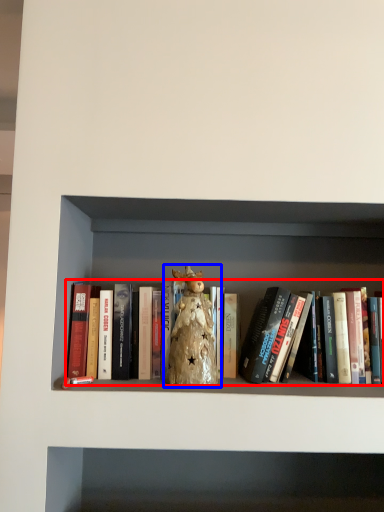
Question: Which object appears closest to the camera in this image, book (highlighted by a red box) or toy (highlighted by a blue box)?

Choices:
 (A) book
 (B) toy

Answer: (B)